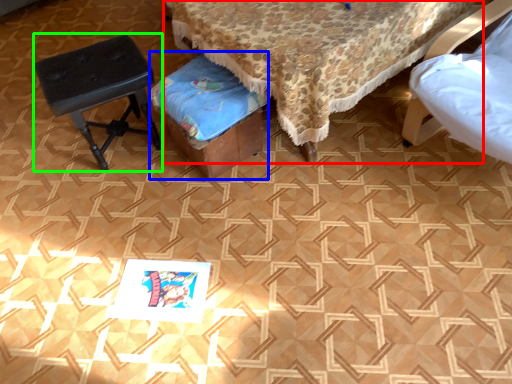
Question: Based on their relative distances, which object is farther from furniture (highlighted by a red box)? Choose from music stool (highlighted by a blue box) and stool (highlighted by a green box).

Choices:
 (A) music stool
 (B) stool

Answer: (B)